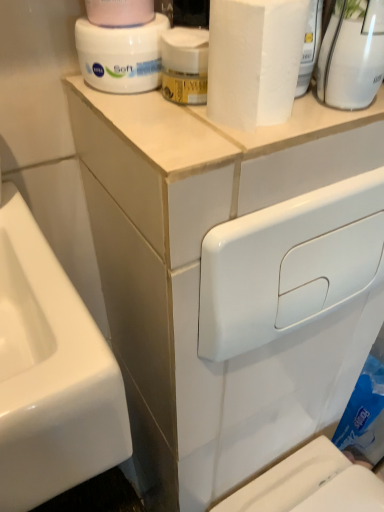
Where is `free location in front of white matte jar at upper center, which ranks as the second cleaning product in right-to-left order`? Image resolution: width=384 pixels, height=512 pixels. free location in front of white matte jar at upper center, which ranks as the second cleaning product in right-to-left order is located at coordinates (157, 124).